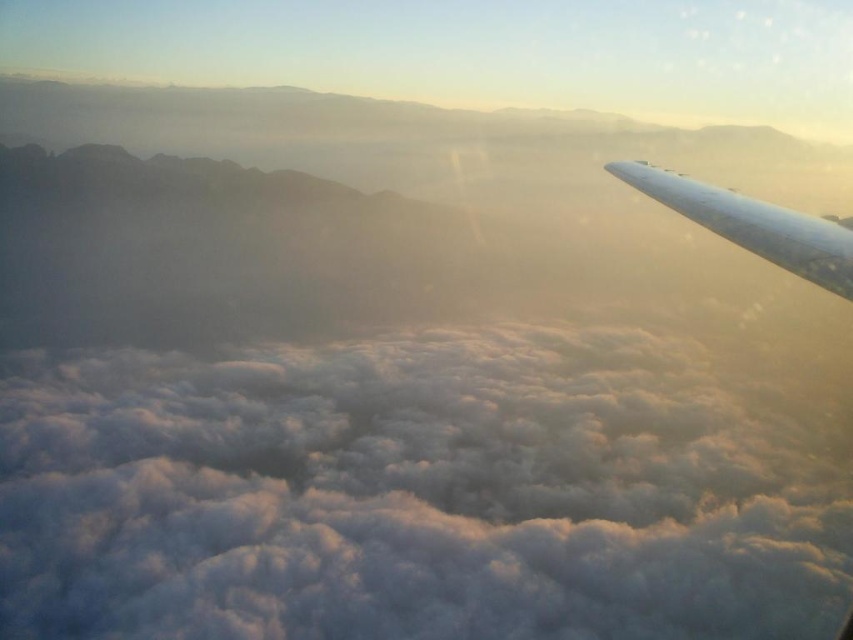
Question: Can you confirm if white fluffy cloud at center is bigger than white glossy wing at upper right?

Choices:
 (A) no
 (B) yes

Answer: (B)

Question: Can you confirm if white fluffy cloud at center is positioned to the right of white glossy wing at upper right?

Choices:
 (A) yes
 (B) no

Answer: (B)

Question: Is white fluffy cloud at center positioned at the back of white glossy wing at upper right?

Choices:
 (A) yes
 (B) no

Answer: (A)

Question: Which point is farther from the camera taking this photo?

Choices:
 (A) (486, 422)
 (B) (633, 170)

Answer: (A)